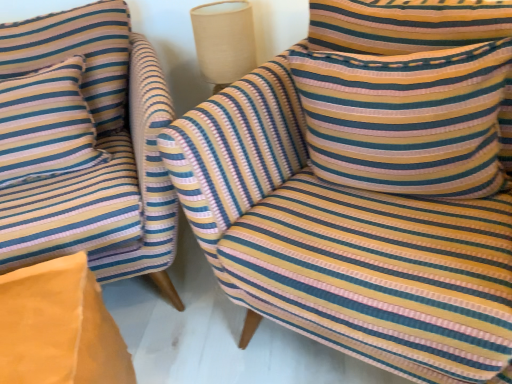
Question: Which direction should I rotate to face striped fabric chair at center, the second chair in the left-to-right sequence, — up or down?

Choices:
 (A) down
 (B) up

Answer: (B)

Question: Is striped fabric pillow at left, the first pillow viewed from the left, closer to camera compared to orange fabric cushion at lower left?

Choices:
 (A) no
 (B) yes

Answer: (A)

Question: Does striped fabric pillow at left, the first pillow viewed from the left, come behind orange fabric cushion at lower left?

Choices:
 (A) no
 (B) yes

Answer: (B)

Question: Does striped fabric pillow at left, which is counted as the 2th pillow, starting from the right, have a lesser height compared to orange fabric cushion at lower left?

Choices:
 (A) yes
 (B) no

Answer: (B)

Question: Is striped fabric pillow at left, which is counted as the 2th pillow, starting from the right, bigger than orange fabric cushion at lower left?

Choices:
 (A) yes
 (B) no

Answer: (B)

Question: From the image's perspective, is striped fabric pillow at left, which is counted as the 2th pillow, starting from the right, on top of orange fabric cushion at lower left?

Choices:
 (A) no
 (B) yes

Answer: (B)

Question: Is striped fabric pillow at left, the first pillow viewed from the left, turned away from orange fabric cushion at lower left?

Choices:
 (A) yes
 (B) no

Answer: (B)

Question: Considering the relative sizes of striped fabric chair at left, which is the 2th chair from right to left, and orange fabric cushion at lower left in the image provided, is striped fabric chair at left, which is the 2th chair from right to left, taller than orange fabric cushion at lower left?

Choices:
 (A) no
 (B) yes

Answer: (B)

Question: Considering the relative positions of striped fabric chair at left, which is the 2th chair from right to left, and orange fabric cushion at lower left in the image provided, is striped fabric chair at left, which is the 2th chair from right to left, to the left of orange fabric cushion at lower left from the viewer's perspective?

Choices:
 (A) no
 (B) yes

Answer: (B)

Question: Is striped fabric chair at left, which is the 2th chair from right to left, thinner than orange fabric cushion at lower left?

Choices:
 (A) no
 (B) yes

Answer: (A)

Question: Is striped fabric chair at left, which is the 2th chair from right to left, surrounding orange fabric cushion at lower left?

Choices:
 (A) yes
 (B) no

Answer: (B)

Question: Is striped fabric chair at left, the first chair positioned from the left, turned away from orange fabric cushion at lower left?

Choices:
 (A) yes
 (B) no

Answer: (B)

Question: Is striped fabric chair at left, the first chair positioned from the left, wider than orange fabric cushion at lower left?

Choices:
 (A) yes
 (B) no

Answer: (A)

Question: Can you confirm if striped fabric pillow at left, the first pillow viewed from the left, is bigger than striped fabric pillow at upper right, marked as the first pillow in a right-to-left arrangement?

Choices:
 (A) yes
 (B) no

Answer: (A)